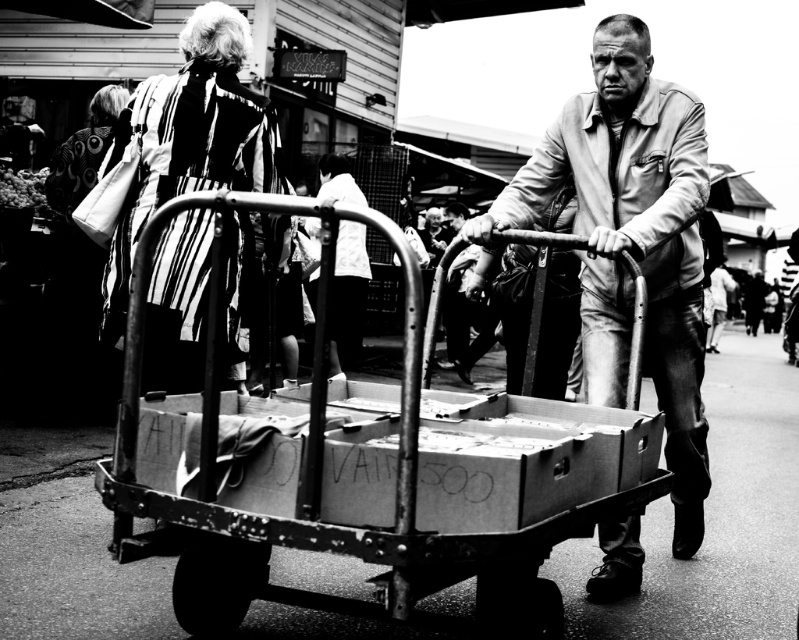
Question: Can you confirm if metallic cart at center is positioned to the right of striped fabric coat at upper left?

Choices:
 (A) yes
 (B) no

Answer: (A)

Question: Estimate the real-world distances between objects in this image. Which object is farther from the matte leather jacket at center?

Choices:
 (A) striped fabric coat at upper left
 (B) metallic cart at center
 (C) white fabric shirt at center

Answer: (C)

Question: Which object is the farthest from the white fabric shirt at center?

Choices:
 (A) matte leather jacket at center
 (B) metallic cart at center

Answer: (B)

Question: Which object is the farthest from the metallic cart at center?

Choices:
 (A) striped fabric coat at upper left
 (B) white fabric shirt at center

Answer: (B)

Question: Is striped fabric coat at upper left positioned in front of white fabric shirt at center?

Choices:
 (A) no
 (B) yes

Answer: (B)

Question: Does matte leather jacket at center lie in front of striped fabric coat at upper left?

Choices:
 (A) yes
 (B) no

Answer: (A)